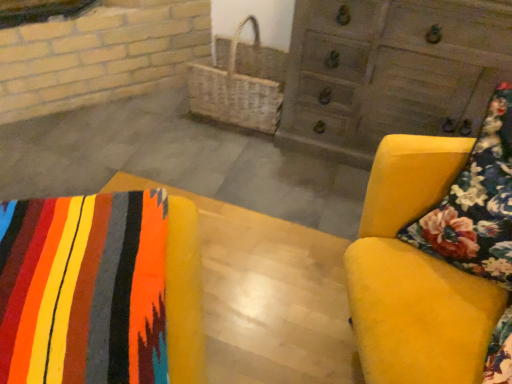
Find the location of a particular element. The height and width of the screenshot is (384, 512). textured wool blanket at lower left, the 1th furniture viewed from the left is located at coordinates coord(100,290).

Measure the distance between point (59,340) and camera.

Point (59,340) is 31.38 inches away from camera.

You are a GUI agent. You are given a task and a screenshot of the screen. Output one action in this format:
    pyautogui.click(x=<x>, y=<y>)
    Task: Click on the floral fabric cushion at right
    This screenshot has height=384, width=512.
    Given the screenshot: What is the action you would take?
    click(476, 204)

What do you see at coordinates (437, 257) in the screenshot? This screenshot has height=384, width=512. I see `velvet yellow armchair at right, placed as the 1th furniture when sorted from right to left` at bounding box center [437, 257].

Where is `woven wicker basket at center`? The height and width of the screenshot is (384, 512). woven wicker basket at center is located at coordinates (240, 83).

Is point (62, 201) positioned behind point (202, 106)?

No, it is in front of (202, 106).

How many degrees apart are the facing directions of textured wool blanket at lower left, the 2th furniture from the right, and woven wicker basket at center?

textured wool blanket at lower left, the 2th furniture from the right, and woven wicker basket at center are facing 27.3 degrees away from each other.

Based on the photo, considering the relative sizes of textured wool blanket at lower left, the 1th furniture viewed from the left, and woven wicker basket at center in the image provided, is textured wool blanket at lower left, the 1th furniture viewed from the left, bigger than woven wicker basket at center?

No.

Considering the sizes of textured wool blanket at lower left, the 2th furniture from the right, and woven wicker basket at center in the image, is textured wool blanket at lower left, the 2th furniture from the right, wider or thinner than woven wicker basket at center?

Considering their sizes, textured wool blanket at lower left, the 2th furniture from the right, looks broader than woven wicker basket at center.

From a real-world perspective, is velvet yellow armchair at right, placed as the 2th furniture when sorted from left to right, above or below wooden chest of drawers at upper right?

In terms of real-world spatial position, velvet yellow armchair at right, placed as the 2th furniture when sorted from left to right, is above wooden chest of drawers at upper right.

From the image's perspective, which is above, velvet yellow armchair at right, placed as the 2th furniture when sorted from left to right, or wooden chest of drawers at upper right?

wooden chest of drawers at upper right appears higher in the image.

Considering the relative sizes of velvet yellow armchair at right, placed as the 1th furniture when sorted from right to left, and wooden chest of drawers at upper right in the image provided, is velvet yellow armchair at right, placed as the 1th furniture when sorted from right to left, thinner than wooden chest of drawers at upper right?

Incorrect, the width of velvet yellow armchair at right, placed as the 1th furniture when sorted from right to left, is not less than that of wooden chest of drawers at upper right.

Considering the sizes of wooden chest of drawers at upper right and woven wicker basket at center in the image, is wooden chest of drawers at upper right bigger or smaller than woven wicker basket at center?

wooden chest of drawers at upper right is bigger than woven wicker basket at center.

Does wooden chest of drawers at upper right have a greater width compared to woven wicker basket at center?

Yes.

Does point (393, 106) appear closer or farther from the camera than point (269, 77)?

Point (393, 106) appears to be closer to the viewer than point (269, 77).

Does wooden chest of drawers at upper right have a lesser height compared to woven wicker basket at center?

No.

Considering the sizes of woven wicker basket at center and wooden chest of drawers at upper right in the image, is woven wicker basket at center wider or thinner than wooden chest of drawers at upper right?

In the image, woven wicker basket at center appears to be more narrow than wooden chest of drawers at upper right.

Can we say woven wicker basket at center lies outside wooden chest of drawers at upper right?

Yes, woven wicker basket at center is not within wooden chest of drawers at upper right.

Considering the positions of objects woven wicker basket at center and wooden chest of drawers at upper right in the image provided, who is behind, woven wicker basket at center or wooden chest of drawers at upper right?

woven wicker basket at center.

From a real-world perspective, is woven wicker basket at center physically below wooden chest of drawers at upper right?

Yes, from a real-world perspective, woven wicker basket at center is under wooden chest of drawers at upper right.

From a real-world perspective, does textured wool blanket at lower left, the 2th furniture from the right, stand above wooden chest of drawers at upper right?

Yes.

Is textured wool blanket at lower left, the 2th furniture from the right, wider or thinner than wooden chest of drawers at upper right?

Considering their sizes, textured wool blanket at lower left, the 2th furniture from the right, looks broader than wooden chest of drawers at upper right.

From the image's perspective, relative to wooden chest of drawers at upper right, is textured wool blanket at lower left, the 2th furniture from the right, above or below?

textured wool blanket at lower left, the 2th furniture from the right, is below wooden chest of drawers at upper right.

From a real-world perspective, is floral fabric cushion at right positioned above or below wooden chest of drawers at upper right?

floral fabric cushion at right is above wooden chest of drawers at upper right.

Is floral fabric cushion at right looking in the opposite direction of wooden chest of drawers at upper right?

Yes, wooden chest of drawers at upper right is at the back of floral fabric cushion at right.

From the picture: Is floral fabric cushion at right surrounding wooden chest of drawers at upper right?

No, wooden chest of drawers at upper right is not surrounded by floral fabric cushion at right.

Is point (328, 63) closer or farther from the camera than point (511, 226)?

Point (328, 63) is farther from the camera than point (511, 226).

In the scene shown: Considering the sizes of objects wooden chest of drawers at upper right and velvet yellow armchair at right, placed as the 2th furniture when sorted from left to right, in the image provided, who is wider, wooden chest of drawers at upper right or velvet yellow armchair at right, placed as the 2th furniture when sorted from left to right,?

velvet yellow armchair at right, placed as the 2th furniture when sorted from left to right, is wider.

Does wooden chest of drawers at upper right have a larger size compared to velvet yellow armchair at right, placed as the 2th furniture when sorted from left to right?

Incorrect, wooden chest of drawers at upper right is not larger than velvet yellow armchair at right, placed as the 2th furniture when sorted from left to right.

Would you say velvet yellow armchair at right, placed as the 2th furniture when sorted from left to right, is part of wooden chest of drawers at upper right's contents?

No, wooden chest of drawers at upper right does not contain velvet yellow armchair at right, placed as the 2th furniture when sorted from left to right.

Where is `the 1st furniture in front of the woven wicker basket at center`? The image size is (512, 384). the 1st furniture in front of the woven wicker basket at center is located at coordinates (100, 290).

Find the location of a particular element. the chest of drawers above the velvet yellow armchair at right, placed as the 1th furniture when sorted from right to left (from the image's perspective) is located at coordinates (391, 70).

Based on their spatial positions, is wooden chest of drawers at upper right or woven wicker basket at center further from textured wool blanket at lower left, the 1th furniture viewed from the left?

Based on the image, woven wicker basket at center appears to be further to textured wool blanket at lower left, the 1th furniture viewed from the left.

Estimate the real-world distances between objects in this image. Which object is closer to wooden chest of drawers at upper right, velvet yellow armchair at right, placed as the 1th furniture when sorted from right to left, or woven wicker basket at center?

woven wicker basket at center is positioned closer to the anchor wooden chest of drawers at upper right.

From the image, which object appears to be nearer to wooden chest of drawers at upper right, woven wicker basket at center or floral fabric cushion at right?

Based on the image, woven wicker basket at center appears to be nearer to wooden chest of drawers at upper right.

When comparing their distances from wooden chest of drawers at upper right, does velvet yellow armchair at right, placed as the 2th furniture when sorted from left to right, or textured wool blanket at lower left, the 1th furniture viewed from the left, seem further?

Based on the image, textured wool blanket at lower left, the 1th furniture viewed from the left, appears to be further to wooden chest of drawers at upper right.

Looking at the image, which one is located further to floral fabric cushion at right, wooden chest of drawers at upper right or velvet yellow armchair at right, placed as the 2th furniture when sorted from left to right?

Based on the image, wooden chest of drawers at upper right appears to be further to floral fabric cushion at right.

Estimate the real-world distances between objects in this image. Which object is closer to textured wool blanket at lower left, the 2th furniture from the right, velvet yellow armchair at right, placed as the 1th furniture when sorted from right to left, or woven wicker basket at center?

Based on the image, velvet yellow armchair at right, placed as the 1th furniture when sorted from right to left, appears to be nearer to textured wool blanket at lower left, the 2th furniture from the right.

Estimate the real-world distances between objects in this image. Which object is further from floral fabric cushion at right, velvet yellow armchair at right, placed as the 1th furniture when sorted from right to left, or textured wool blanket at lower left, the 1th furniture viewed from the left?

The object further to floral fabric cushion at right is textured wool blanket at lower left, the 1th furniture viewed from the left.

From the image, which object appears to be farther from textured wool blanket at lower left, the 1th furniture viewed from the left, floral fabric cushion at right or woven wicker basket at center?

The object further to textured wool blanket at lower left, the 1th furniture viewed from the left, is woven wicker basket at center.

Locate an element on the screen. This screenshot has width=512, height=384. throw pillow between textured wool blanket at lower left, the 1th furniture viewed from the left, and wooden chest of drawers at upper right is located at coordinates (476, 204).

The width and height of the screenshot is (512, 384). Identify the location of throw pillow between velvet yellow armchair at right, placed as the 2th furniture when sorted from left to right, and woven wicker basket at center from front to back. (476, 204).

The width and height of the screenshot is (512, 384). I want to click on furniture located between textured wool blanket at lower left, the 1th furniture viewed from the left, and wooden chest of drawers at upper right in the left-right direction, so click(x=437, y=257).

Locate an element on the screen. This screenshot has height=384, width=512. throw pillow between textured wool blanket at lower left, the 2th furniture from the right, and woven wicker basket at center, along the z-axis is located at coordinates (476, 204).